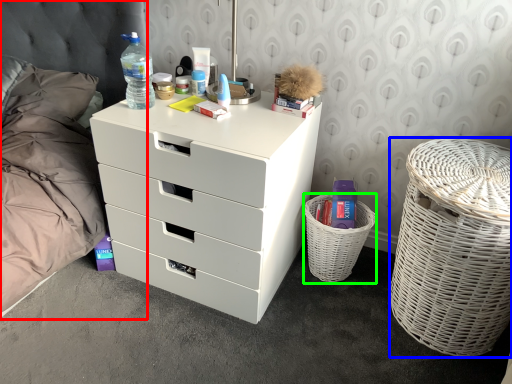
Question: Based on their relative distances, which object is nearer to bed (highlighted by a red box)? Choose from basket container (highlighted by a blue box) and basket (highlighted by a green box).

Choices:
 (A) basket container
 (B) basket

Answer: (B)